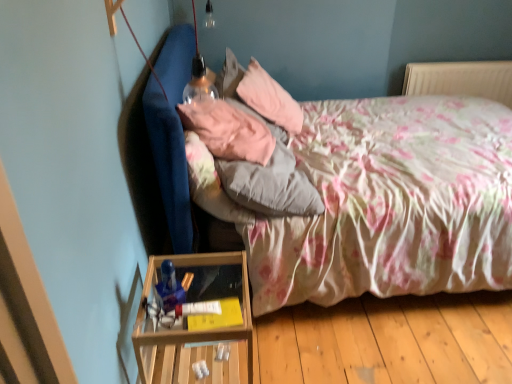
Question: Which direction should I rotate to face pink fabric pillow at upper center, acting as the 1th pillow starting from the front, — up or down?

Choices:
 (A) down
 (B) up

Answer: (B)

Question: Can you confirm if pink fabric pillow at upper center, the second pillow when ordered from back to front, is shorter than floral fabric bed at center?

Choices:
 (A) no
 (B) yes

Answer: (B)

Question: Considering the relative positions of pink fabric pillow at upper center, acting as the 1th pillow starting from the front, and floral fabric bed at center in the image provided, is pink fabric pillow at upper center, acting as the 1th pillow starting from the front, in front of floral fabric bed at center?

Choices:
 (A) no
 (B) yes

Answer: (A)

Question: From the image's perspective, is pink fabric pillow at upper center, acting as the 1th pillow starting from the front, below floral fabric bed at center?

Choices:
 (A) yes
 (B) no

Answer: (B)

Question: From the image's perspective, is pink fabric pillow at upper center, the second pillow when ordered from back to front, on top of floral fabric bed at center?

Choices:
 (A) yes
 (B) no

Answer: (A)

Question: Is pink fabric pillow at upper center, acting as the 1th pillow starting from the front, at the right side of floral fabric bed at center?

Choices:
 (A) yes
 (B) no

Answer: (B)

Question: Is pink fabric pillow at upper center, the second pillow when ordered from back to front, not inside floral fabric bed at center?

Choices:
 (A) yes
 (B) no

Answer: (B)

Question: Could you tell me if floral fabric bed at center is turned towards velvet pink pillow at upper center, the 2th pillow from the front?

Choices:
 (A) no
 (B) yes

Answer: (A)

Question: Can you confirm if floral fabric bed at center is positioned to the left of velvet pink pillow at upper center, the 2th pillow from the front?

Choices:
 (A) yes
 (B) no

Answer: (B)

Question: Is floral fabric bed at center smaller than velvet pink pillow at upper center, the first pillow when ordered from back to front?

Choices:
 (A) no
 (B) yes

Answer: (A)

Question: Is floral fabric bed at center taller than velvet pink pillow at upper center, the 2th pillow from the front?

Choices:
 (A) no
 (B) yes

Answer: (B)

Question: From a real-world perspective, is floral fabric bed at center positioned over velvet pink pillow at upper center, the 2th pillow from the front, based on gravity?

Choices:
 (A) yes
 (B) no

Answer: (B)

Question: Does floral fabric bed at center have a greater width compared to velvet pink pillow at upper center, the 2th pillow from the front?

Choices:
 (A) yes
 (B) no

Answer: (A)

Question: Can you see pink fabric pillow at upper center, acting as the 1th pillow starting from the front, touching velvet pink pillow at upper center, the 2th pillow from the front?

Choices:
 (A) yes
 (B) no

Answer: (B)